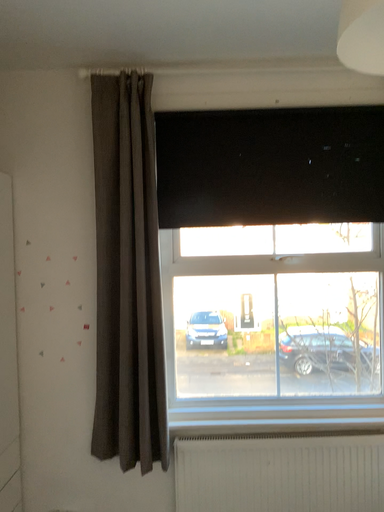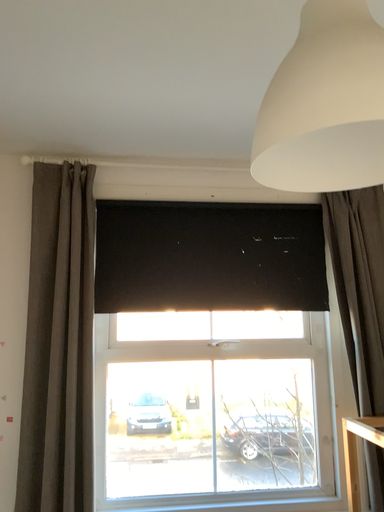
Question: How did the camera likely rotate when shooting the video?

Choices:
 (A) rotated left
 (B) rotated right

Answer: (B)